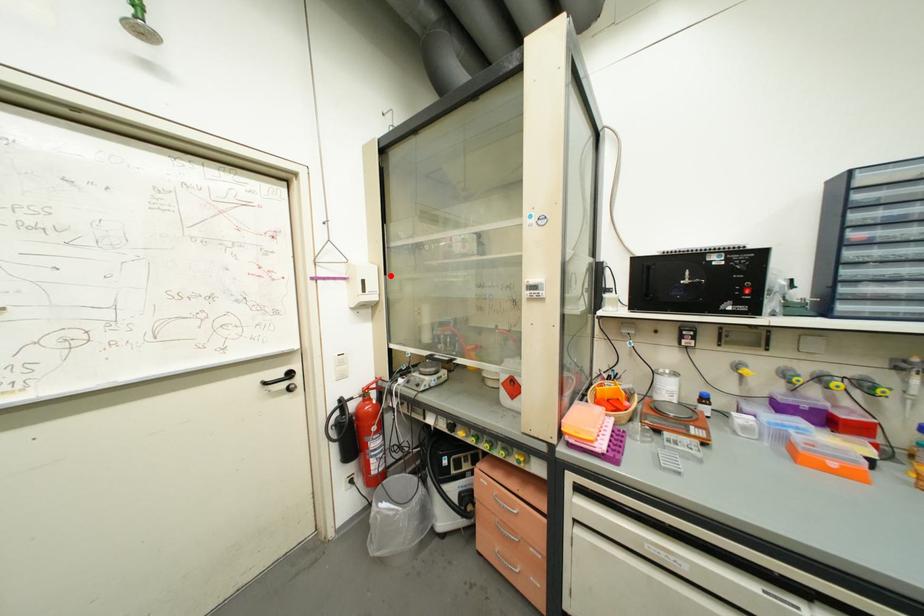
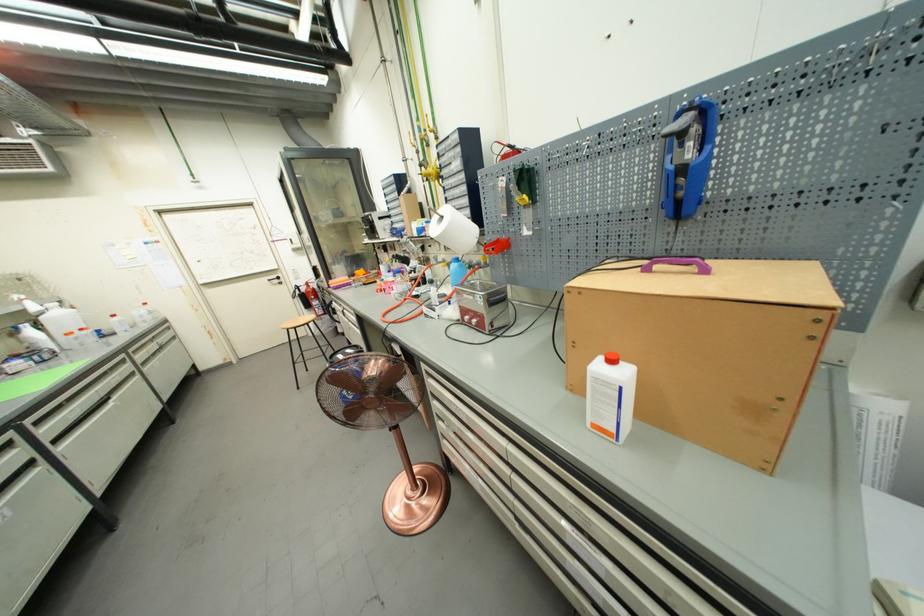
Locate, in the second image, the point that corresponds to the highlighted location in the first image.

(306, 237)